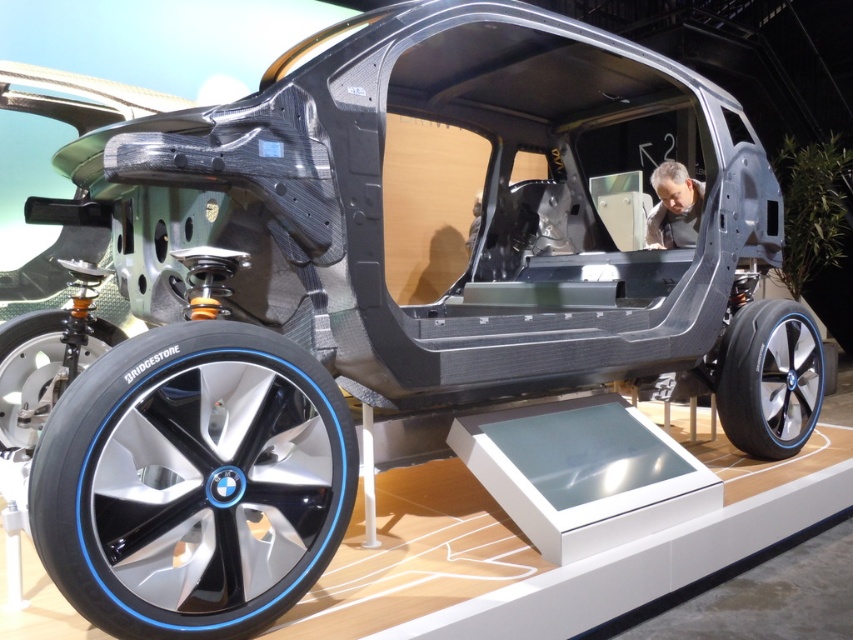
Question: Which is farther from the polished aluminum wheel at lower left?

Choices:
 (A) gray matte skin at center
 (B) shiny silver rim at lower left
 (C) shiny metallic wheel at lower right

Answer: (A)

Question: In this image, where is shiny metallic wheel at lower right located relative to shiny silver rim at lower left?

Choices:
 (A) left
 (B) right

Answer: (B)

Question: Which object is positioned closest to the gray matte skin at center?

Choices:
 (A) shiny metallic wheel at lower right
 (B) polished aluminum wheel at lower left
 (C) shiny silver rim at lower left

Answer: (A)

Question: Is shiny metallic wheel at lower right further to the viewer compared to gray matte skin at center?

Choices:
 (A) yes
 (B) no

Answer: (B)

Question: Estimate the real-world distances between objects in this image. Which object is closer to the shiny silver rim at lower left?

Choices:
 (A) gray matte skin at center
 (B) shiny metallic wheel at lower right

Answer: (B)

Question: Does shiny metallic wheel at lower right have a larger size compared to gray matte skin at center?

Choices:
 (A) yes
 (B) no

Answer: (A)